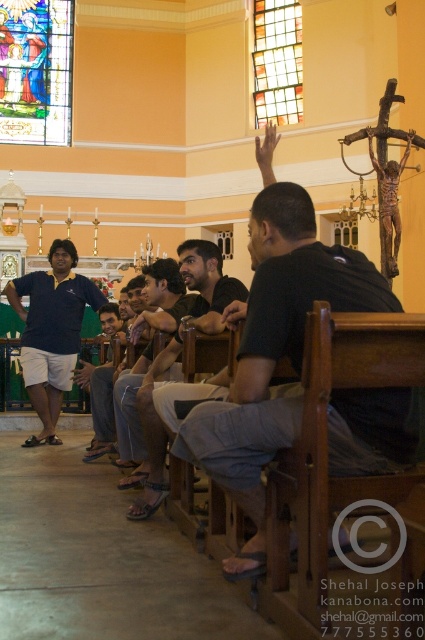
You are standing in the church and want to take a photo of the stained glass window at upper left without including the matte blue shirt at left in the frame. Is this possible given their positions?

The stained glass window at upper left is further to the viewer than the matte blue shirt at left, so you can position yourself to capture the stained glass window at upper left while excluding the matte blue shirt at left from the frame since it is behind.

In the scene shown: Based on the scene description, which object from the list is taller? The stained glass window at upper left or the translucent stained glass at upper center?

The stained glass window at upper left is taller than the translucent stained glass at upper center according to the description.

You are an interior designer planning to install a new light fixture in the church. The stained glass window at upper left and the matte blue shirt at left are both in your line of sight. Which object would cast a larger shadow if the light is placed directly above them?

The stained glass window at upper left has a larger size compared to the matte blue shirt at left, so it would cast a larger shadow.